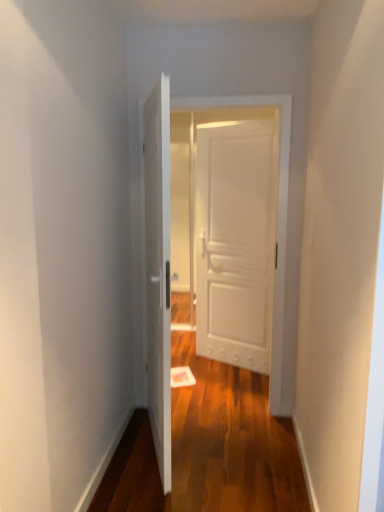
This screenshot has width=384, height=512. I want to click on vacant area on the back side of white wooden door at center, the second door from the back, so click(207, 385).